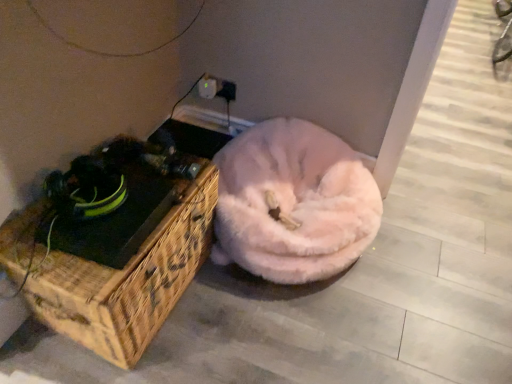
This screenshot has height=384, width=512. I want to click on free space that is in between woven wood chest at left and fuzzy pink dog bed at center, so click(238, 324).